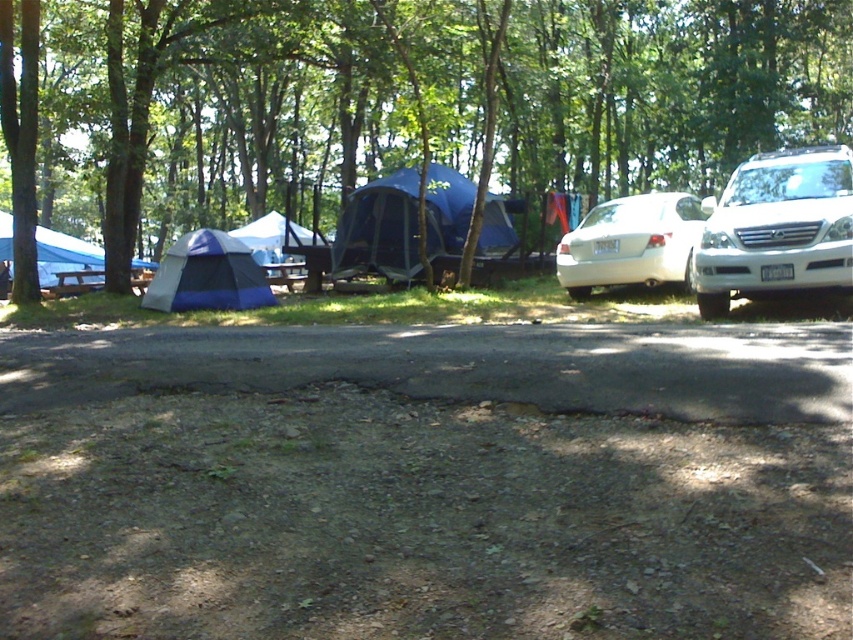
Is white glossy suv at right above blue fabric tent at center?

Actually, white glossy suv at right is below blue fabric tent at center.

Is white glossy suv at right shorter than blue fabric tent at center?

Indeed, white glossy suv at right has a lesser height compared to blue fabric tent at center.

Who is more forward, (827, 259) or (265, 243)?

Point (827, 259)

Where is `white glossy suv at right`? white glossy suv at right is located at coordinates (776, 227).

Is point (215, 262) positioned behind point (3, 234)?

No.

Is point (225, 266) in front of point (78, 272)?

Yes, it is in front of point (78, 272).

Locate an element on the screen. blue/gray fabric tent at center-left is located at coordinates (207, 275).

How far apart are blue mesh tent at center and blue/gray fabric tent at left?

4.39 meters

Is blue mesh tent at center in front of blue/gray fabric tent at left?

No, blue mesh tent at center is further to the viewer.

Measure the distance between point (407,202) and camera.

The distance of point (407,202) from camera is 12.45 meters.

Locate an element on the screen. The width and height of the screenshot is (853, 640). blue mesh tent at center is located at coordinates (380, 228).